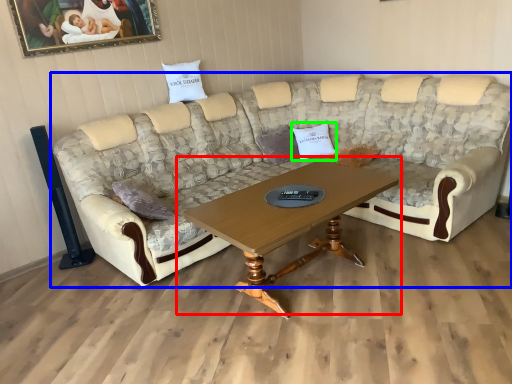
Question: Based on their relative distances, which object is farther from coffee table (highlighted by a red box)? Choose from studio couch (highlighted by a blue box) and pillow (highlighted by a green box).

Choices:
 (A) studio couch
 (B) pillow

Answer: (B)